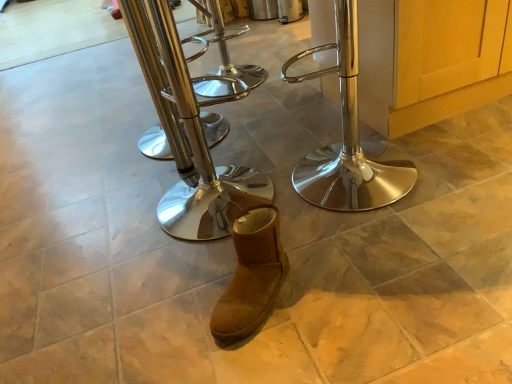
Question: Is polished chrome stool at center, which ranks as the 3th step stool in left-to-right order, spatially inside polished chrome stool at center, the second step stool when ordered from left to right, or outside of it?

Choices:
 (A) inside
 (B) outside

Answer: (B)

Question: Considering the positions of polished chrome stool at center, which appears as the 1th step stool when viewed from the right, and polished chrome stool at center, the second step stool when ordered from left to right, in the image, is polished chrome stool at center, which appears as the 1th step stool when viewed from the right, bigger or smaller than polished chrome stool at center, the second step stool when ordered from left to right,?

Choices:
 (A) small
 (B) big

Answer: (A)

Question: Based on their relative distances, which object is nearer to the polished metal bar stool at center, which is the 1th step stool from left to right?

Choices:
 (A) polished chrome stool at center, the second step stool viewed from the right
 (B) brown suede boot at center
 (C) polished chrome stool at center, which ranks as the 3th step stool in left-to-right order

Answer: (A)

Question: Estimate the real-world distances between objects in this image. Which object is farther from the polished chrome stool at center, which appears as the 1th step stool when viewed from the right?

Choices:
 (A) polished chrome stool at center, the second step stool viewed from the right
 (B) polished metal bar stool at center, which is the 1th step stool from left to right
 (C) brown suede boot at center

Answer: (B)